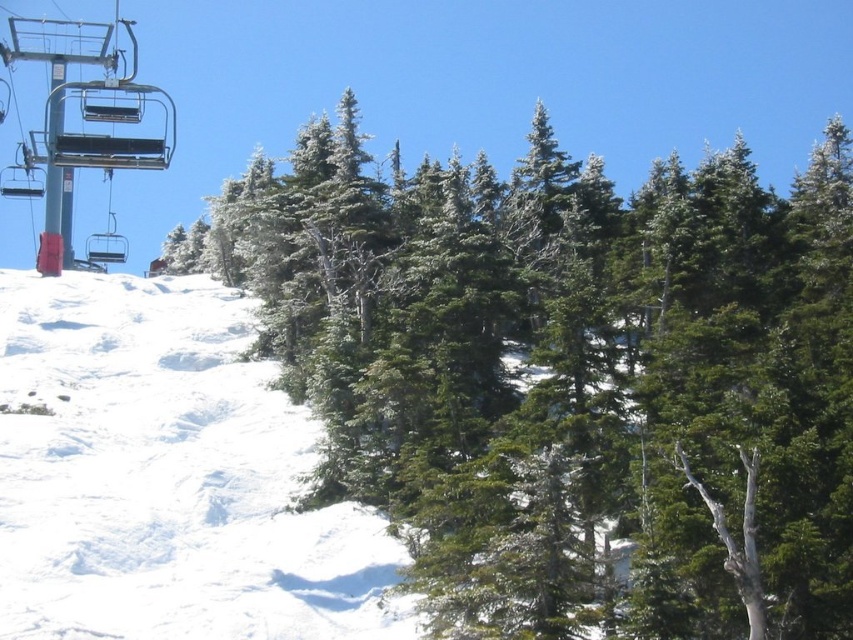
Does green matte tree at upper center appear on the right side of white powdery snow at center?

Indeed, green matte tree at upper center is positioned on the right side of white powdery snow at center.

Where is `green matte tree at upper center`? This screenshot has width=853, height=640. green matte tree at upper center is located at coordinates (567, 378).

This screenshot has width=853, height=640. Identify the location of green matte tree at upper center. (567, 378).

Can you confirm if green matte tree at upper center is taller than metallic blue ski lift at upper left?

Incorrect, green matte tree at upper center's height is not larger of metallic blue ski lift at upper left's.

How much distance is there between green matte tree at upper center and metallic blue ski lift at upper left?

138.14 feet

What do you see at coordinates (567, 378) in the screenshot? This screenshot has width=853, height=640. I see `green matte tree at upper center` at bounding box center [567, 378].

Find the location of a particular element. Image resolution: width=853 pixels, height=640 pixels. green matte tree at upper center is located at coordinates (567, 378).

Is white powdery snow at center positioned before metallic blue ski lift at upper left?

Yes, it is.

Image resolution: width=853 pixels, height=640 pixels. Identify the location of white powdery snow at center. (166, 476).